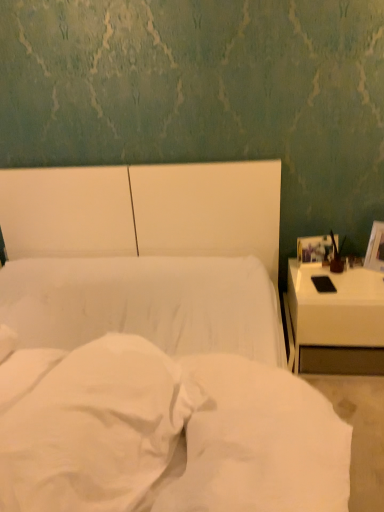
I want to click on vacant space in front of matte brown vase at right, so click(x=352, y=287).